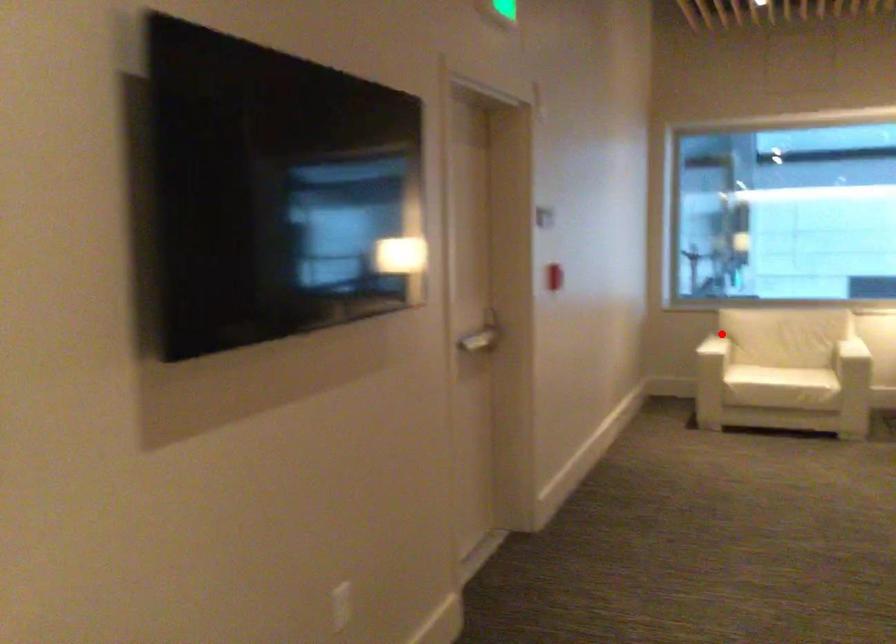
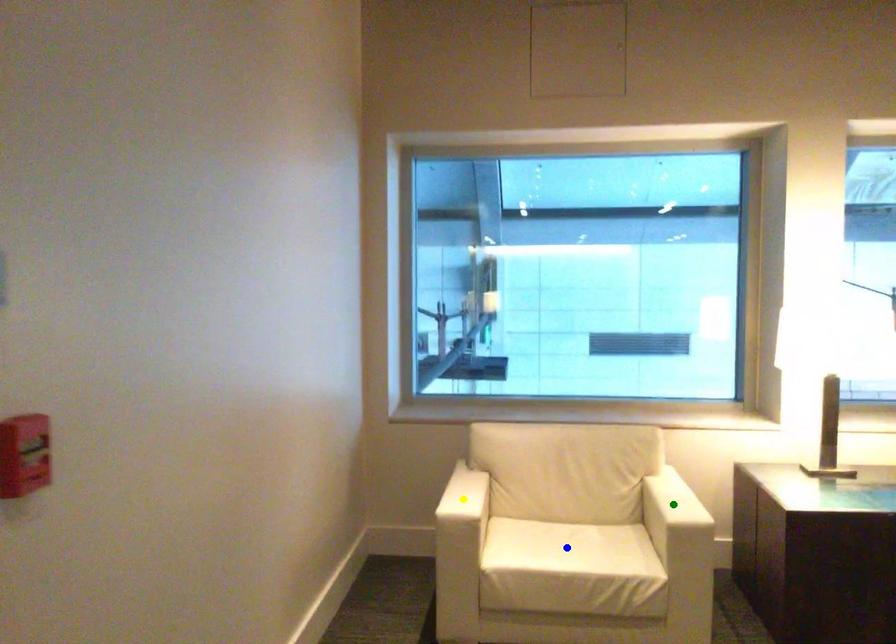
Question: I am providing you with two images of the same scene from different viewpoints. A red point is marked on the first image. You are given multiple points on the second image. Which point in image 2 is actually the same real-world point as the red point in image 1?

Choices:
 (A) blue point
 (B) green point
 (C) yellow point

Answer: (C)